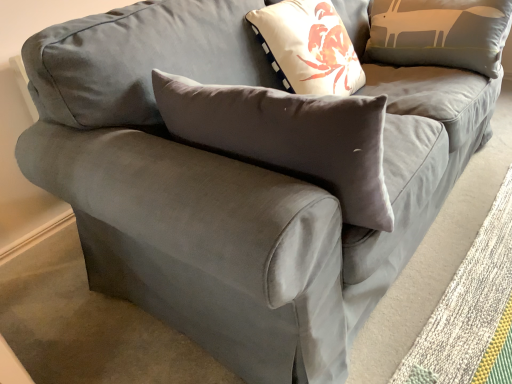
What is the approximate width of beige textured mat at lower right?

12.65 inches.

This screenshot has width=512, height=384. Describe the element at coordinates (471, 312) in the screenshot. I see `beige textured mat at lower right` at that location.

I want to click on beige textured mat at lower right, so click(471, 312).

The image size is (512, 384). I want to click on beige textured mat at lower right, so click(x=471, y=312).